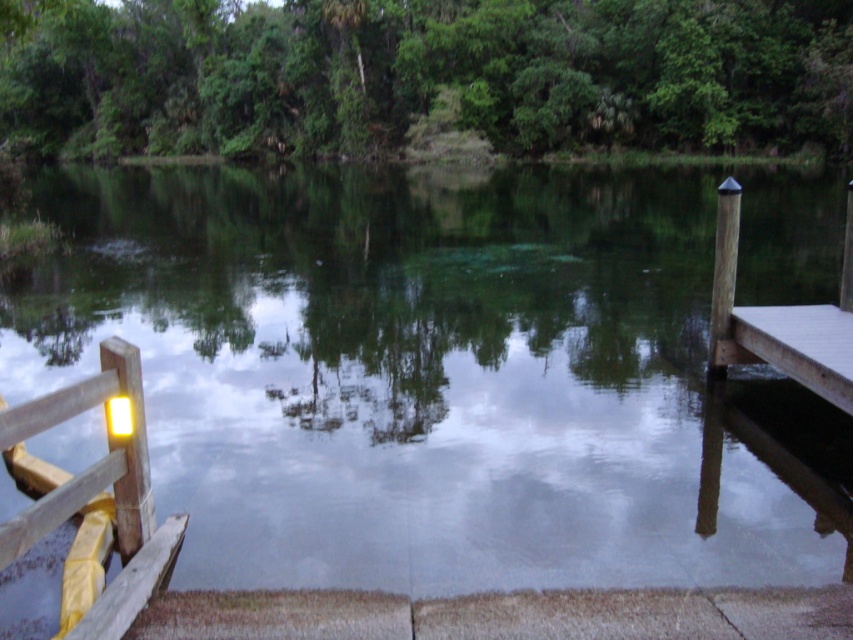
Question: Does green leafy tree at upper center appear on the right side of brown wooden dock at right?

Choices:
 (A) no
 (B) yes

Answer: (A)

Question: Which point appears farthest from the camera in this image?

Choices:
 (A) pos(410,321)
 (B) pos(811,310)
 (C) pos(76,403)

Answer: (A)

Question: Which point appears closest to the camera in this image?

Choices:
 (A) (733, 218)
 (B) (280, 388)
 (C) (144, 600)

Answer: (C)

Question: Can you confirm if yellow painted wood at left is smaller than brown wooden dock at right?

Choices:
 (A) no
 (B) yes

Answer: (B)

Question: Where is yellow painted wood at left located in relation to brown wooden dock at right in the image?

Choices:
 (A) above
 (B) below

Answer: (B)

Question: Which point is farther to the camera?

Choices:
 (A) green reflective water at center
 (B) green leafy tree at upper center

Answer: (B)